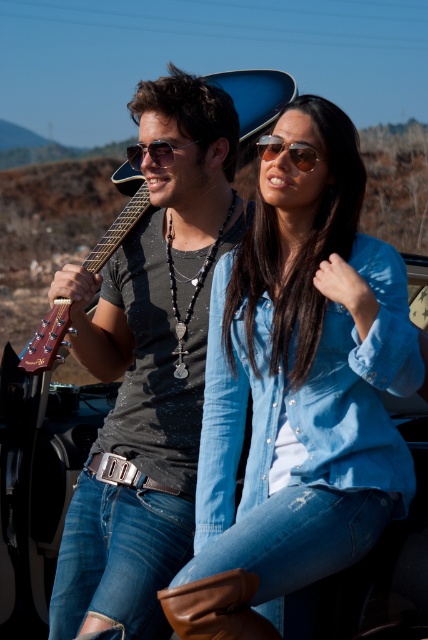
Is point (119, 410) positioned after point (137, 150)?

Yes, point (119, 410) is behind point (137, 150).

Can you confirm if matte black shirt at center is positioned to the right of sunglasses at center?

Incorrect, matte black shirt at center is not on the right side of sunglasses at center.

Who is more forward, (127, 296) or (163, 154)?

Positioned in front is point (163, 154).

This screenshot has width=428, height=640. I want to click on matte black shirt at center, so click(x=148, y=368).

Can you confirm if wooden acoustic guitar at left is bigger than sunglasses at center?

Indeed, wooden acoustic guitar at left has a larger size compared to sunglasses at center.

This screenshot has width=428, height=640. Describe the element at coordinates (255, 96) in the screenshot. I see `wooden acoustic guitar at left` at that location.

Which is in front, point (53, 339) or point (133, 156)?

Point (53, 339) is in front.

What are the coordinates of `wooden acoustic guitar at left` in the screenshot? It's located at (255, 96).

Who is taller, denim shirt at center or sunglasses at center?

denim shirt at center

Who is shorter, denim shirt at center or sunglasses at center?

Standing shorter between the two is sunglasses at center.

The width and height of the screenshot is (428, 640). What do you see at coordinates (297, 394) in the screenshot?
I see `denim shirt at center` at bounding box center [297, 394].

Locate an element on the screen. denim shirt at center is located at coordinates (297, 394).